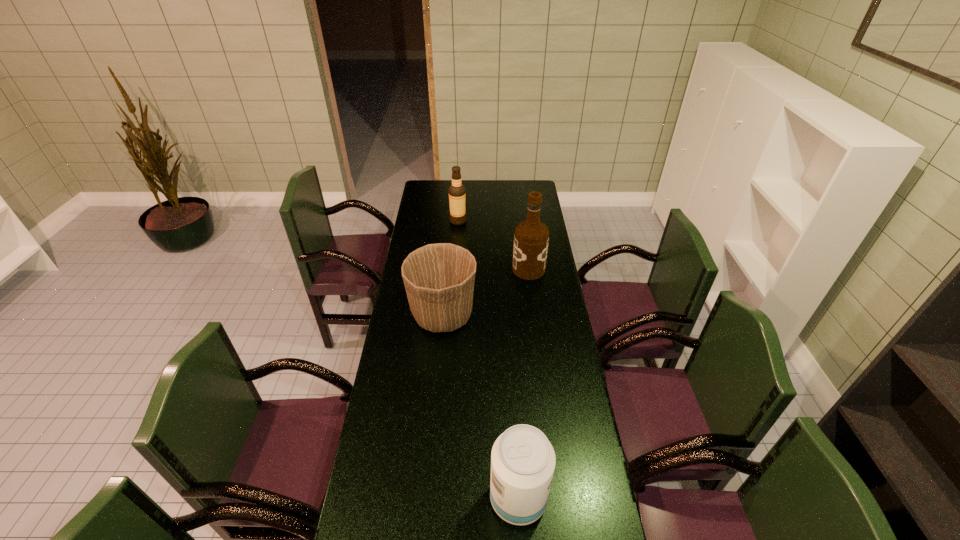
You are a GUI agent. You are given a task and a screenshot of the screen. Output one action in this format:
    pyautogui.click(x=<x>, y=<y>)
    Task: Click on the free space that is in between the tallest alcohol and the nearest object
    The height and width of the screenshot is (540, 960).
    Given the screenshot: What is the action you would take?
    pyautogui.click(x=523, y=384)

Where is `free point between the nearest object and the flowerpot`? The height and width of the screenshot is (540, 960). free point between the nearest object and the flowerpot is located at coordinates (481, 407).

Identify the location of free space between the farthest object and the nearest alcohol. The height and width of the screenshot is (540, 960). (488, 360).

This screenshot has height=540, width=960. I want to click on free space between the tallest alcohol and the nearest object, so click(523, 384).

Identify the location of free space between the leftmost alcohol and the nearest alcohol. [x=488, y=360].

Find the location of a particular element. The width and height of the screenshot is (960, 540). empty location between the farthest alcohol and the second nearest alcohol is located at coordinates (493, 245).

Identify the location of object that is the third nearest to the farthest object. pos(523,460).

Locate an element on the screen. object that stands as the third closest to the third farthest object is located at coordinates (523, 460).

Select which alcohol appears as the closest to the nearest alcohol. Please provide its 2D coordinates. Your answer should be formatted as a tuple, i.e. [(x, y)], where the tuple contains the x and y coordinates of a point satisfying the conditions above.

[(531, 237)]

Identify which alcohol is the nearest to the leftmost alcohol. Please provide its 2D coordinates. Your answer should be formatted as a tuple, i.e. [(x, y)], where the tuple contains the x and y coordinates of a point satisfying the conditions above.

[(531, 237)]